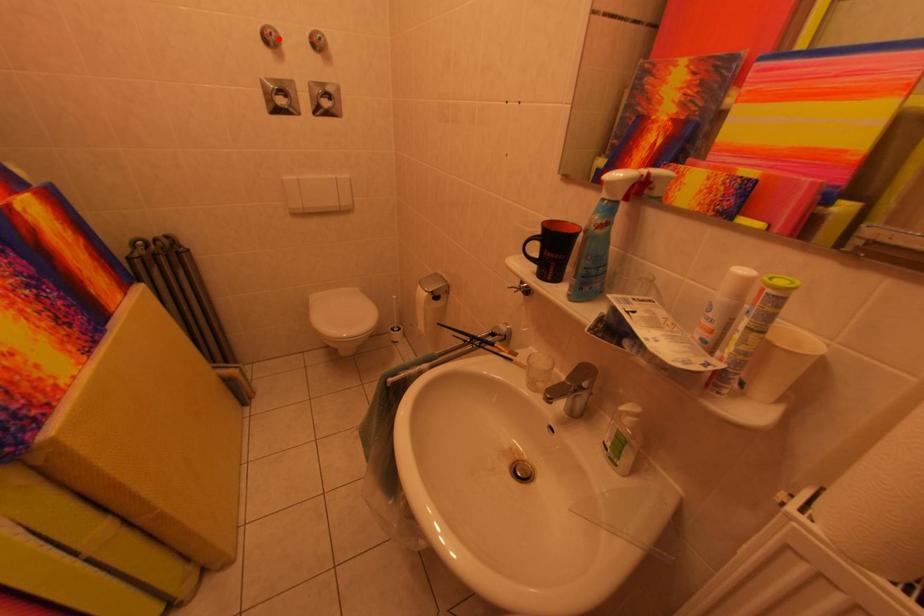
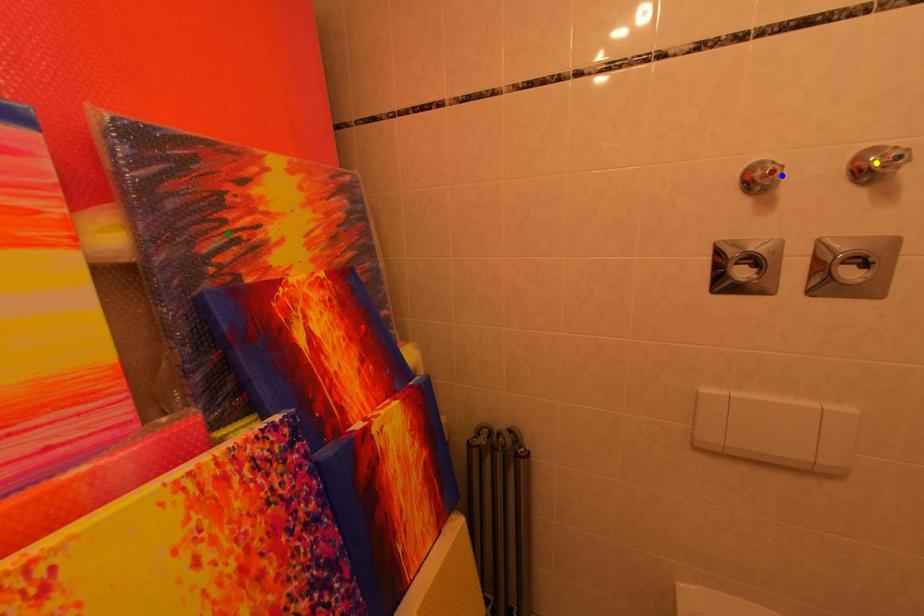
Question: I am providing you with two images of the same scene from different viewpoints. A red point is marked on the first image. You are given multiple points on the second image. Which spot in image 2 lines up with the point in image 1?

Choices:
 (A) green point
 (B) blue point
 (C) yellow point

Answer: (B)